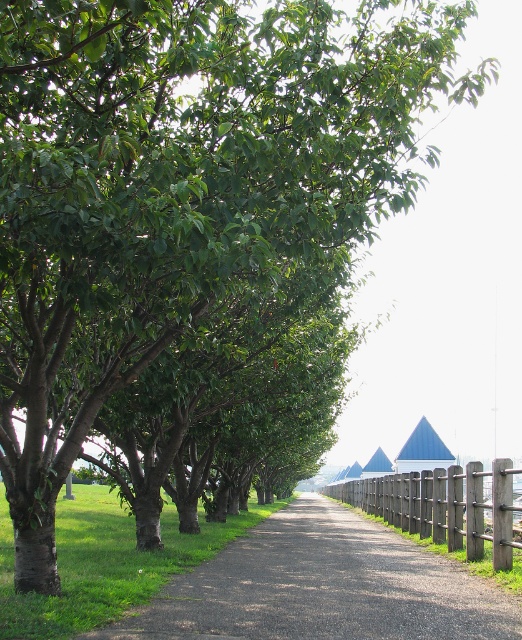
Question: Does gravel path at center lie in front of brown wooden fence at center?

Choices:
 (A) no
 (B) yes

Answer: (B)

Question: Which of the following is the closest to the observer?

Choices:
 (A) (469, 480)
 (B) (231, 612)

Answer: (B)

Question: Is gravel path at center positioned behind brown wooden fence at center?

Choices:
 (A) no
 (B) yes

Answer: (A)

Question: Is gravel path at center thinner than brown wooden fence at center?

Choices:
 (A) no
 (B) yes

Answer: (A)